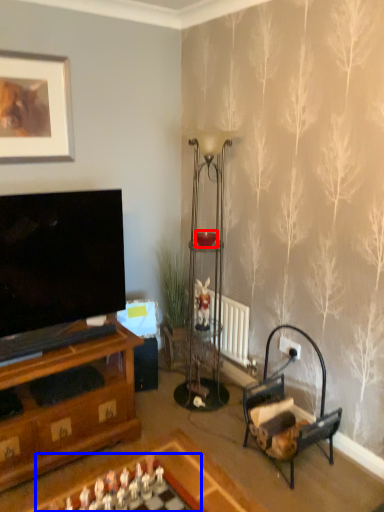
Question: Which object is further to the camera taking this photo, candle holder (highlighted by a red box) or board game (highlighted by a blue box)?

Choices:
 (A) candle holder
 (B) board game

Answer: (A)